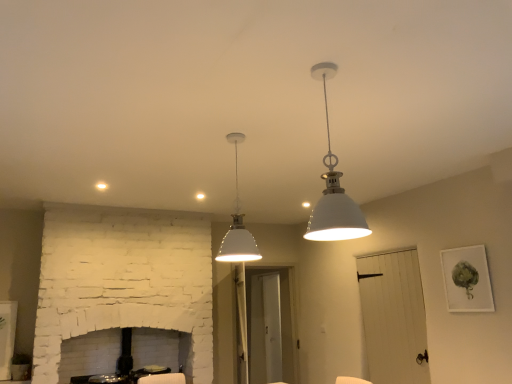
Question: Are white matte pendant light at center, the first lamp in the back-to-front sequence, and matte white picture frame at upper right making contact?

Choices:
 (A) no
 (B) yes

Answer: (A)

Question: Would you say white matte pendant light at center, which is the 1th lamp in left-to-right order, contains matte white picture frame at upper right?

Choices:
 (A) yes
 (B) no

Answer: (B)

Question: Is white matte pendant light at center, the second lamp in the right-to-left sequence, further to camera compared to matte white picture frame at upper right?

Choices:
 (A) yes
 (B) no

Answer: (B)

Question: Is white matte pendant light at center, the first lamp in the back-to-front sequence, not within matte white picture frame at upper right?

Choices:
 (A) no
 (B) yes

Answer: (B)

Question: Are white matte pendant light at center, the first lamp in the back-to-front sequence, and matte white picture frame at upper right far apart?

Choices:
 (A) no
 (B) yes

Answer: (B)

Question: Can you confirm if white matte pendant light at center, which is the 1th lamp in left-to-right order, is positioned to the right of matte white picture frame at upper right?

Choices:
 (A) yes
 (B) no

Answer: (B)

Question: Is white matte pendant light at upper center, positioned as the second lamp in back-to-front order, positioned before matte white picture frame at upper right?

Choices:
 (A) yes
 (B) no

Answer: (A)

Question: Considering the relative sizes of white matte pendant light at upper center, acting as the 1th lamp starting from the right, and matte white picture frame at upper right in the image provided, is white matte pendant light at upper center, acting as the 1th lamp starting from the right, bigger than matte white picture frame at upper right?

Choices:
 (A) no
 (B) yes

Answer: (B)

Question: Considering the relative positions of white matte pendant light at upper center, which is the second lamp in left-to-right order, and matte white picture frame at upper right in the image provided, is white matte pendant light at upper center, which is the second lamp in left-to-right order, to the right of matte white picture frame at upper right from the viewer's perspective?

Choices:
 (A) no
 (B) yes

Answer: (A)

Question: Considering the relative positions of white matte pendant light at upper center, which is the second lamp in left-to-right order, and matte white picture frame at upper right in the image provided, is white matte pendant light at upper center, which is the second lamp in left-to-right order, behind matte white picture frame at upper right?

Choices:
 (A) yes
 (B) no

Answer: (B)

Question: Is white matte pendant light at upper center, acting as the 1th lamp starting from the right, taller than matte white picture frame at upper right?

Choices:
 (A) no
 (B) yes

Answer: (B)

Question: From a real-world perspective, is white matte pendant light at upper center, positioned as the second lamp in back-to-front order, under matte white picture frame at upper right?

Choices:
 (A) no
 (B) yes

Answer: (A)

Question: From a real-world perspective, does white matte pendant light at upper center, the first lamp viewed from the front, sit lower than white matte pendant light at center, which is the 1th lamp in left-to-right order?

Choices:
 (A) no
 (B) yes

Answer: (B)